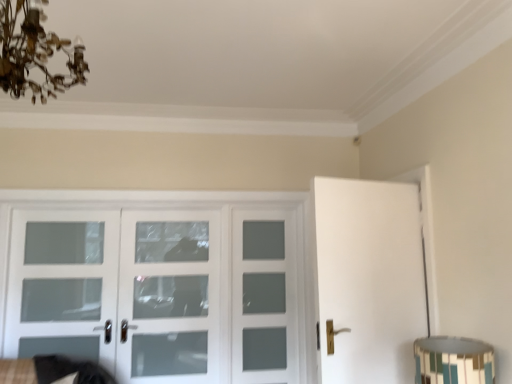
Question: Should I look upward or downward to see multicolored mosaic lampshade at lower right?

Choices:
 (A) down
 (B) up

Answer: (A)

Question: From a real-world perspective, does white frosted glass door at center, the 1th screen door in the right-to-left sequence, sit lower than multicolored mosaic lampshade at lower right?

Choices:
 (A) no
 (B) yes

Answer: (A)

Question: Is white frosted glass door at center, the 1th screen door in the right-to-left sequence, positioned behind multicolored mosaic lampshade at lower right?

Choices:
 (A) yes
 (B) no

Answer: (A)

Question: Considering the relative positions of white frosted glass door at center, placed as the 3th screen door when sorted from left to right, and multicolored mosaic lampshade at lower right in the image provided, is white frosted glass door at center, placed as the 3th screen door when sorted from left to right, in front of multicolored mosaic lampshade at lower right?

Choices:
 (A) no
 (B) yes

Answer: (A)

Question: Is white frosted glass door at center, placed as the 3th screen door when sorted from left to right, to the right of multicolored mosaic lampshade at lower right from the viewer's perspective?

Choices:
 (A) yes
 (B) no

Answer: (B)

Question: Is white frosted glass door at center, placed as the 3th screen door when sorted from left to right, shorter than multicolored mosaic lampshade at lower right?

Choices:
 (A) no
 (B) yes

Answer: (A)

Question: Considering the relative sizes of white frosted glass door at center, the 1th screen door in the right-to-left sequence, and multicolored mosaic lampshade at lower right in the image provided, is white frosted glass door at center, the 1th screen door in the right-to-left sequence, taller than multicolored mosaic lampshade at lower right?

Choices:
 (A) yes
 (B) no

Answer: (A)

Question: Is clear glass door at left, which is the third screen door from right to left, looking in the opposite direction of multicolored mosaic lampshade at lower right?

Choices:
 (A) no
 (B) yes

Answer: (A)

Question: Does clear glass door at left, which is the third screen door from right to left, have a smaller size compared to multicolored mosaic lampshade at lower right?

Choices:
 (A) yes
 (B) no

Answer: (B)

Question: Considering the relative sizes of clear glass door at left, which is counted as the first screen door, starting from the left, and multicolored mosaic lampshade at lower right in the image provided, is clear glass door at left, which is counted as the first screen door, starting from the left, shorter than multicolored mosaic lampshade at lower right?

Choices:
 (A) no
 (B) yes

Answer: (A)

Question: Is clear glass door at left, which is the third screen door from right to left, to the right of multicolored mosaic lampshade at lower right from the viewer's perspective?

Choices:
 (A) yes
 (B) no

Answer: (B)

Question: From a real-world perspective, does clear glass door at left, which is counted as the first screen door, starting from the left, stand above multicolored mosaic lampshade at lower right?

Choices:
 (A) no
 (B) yes

Answer: (B)

Question: From the image's perspective, would you say clear glass door at left, which is the third screen door from right to left, is positioned over multicolored mosaic lampshade at lower right?

Choices:
 (A) yes
 (B) no

Answer: (A)

Question: Does clear glass door at left, which is the third screen door from right to left, have a larger size compared to white frosted glass door at center, arranged as the second screen door when viewed from the right?

Choices:
 (A) no
 (B) yes

Answer: (B)